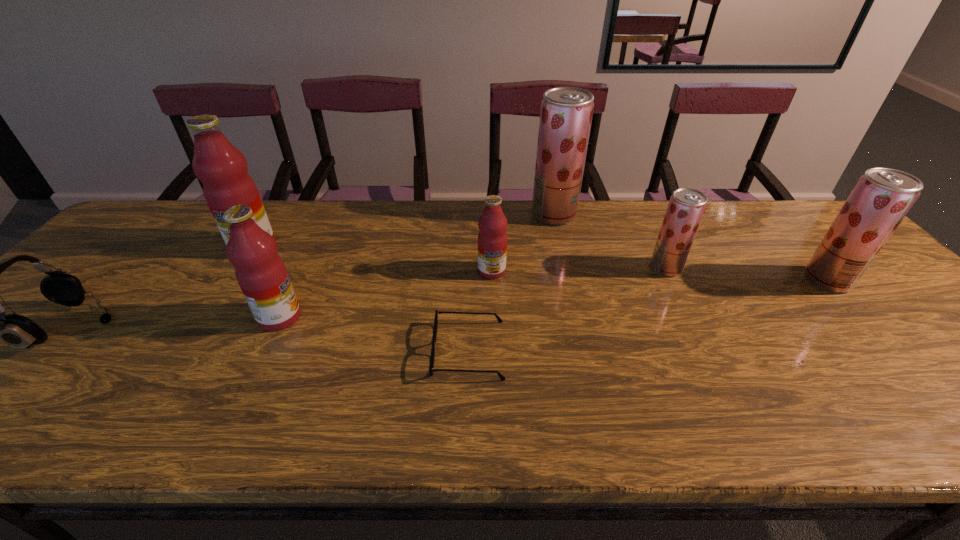
Locate an element on the screen. The height and width of the screenshot is (540, 960). vacant space located 0.060m on the label of the rightmost pink fruit juice is located at coordinates (492, 296).

Locate an element on the screen. This screenshot has width=960, height=540. free location located with the microphone on the side of the leftmost object is located at coordinates (218, 327).

Locate an element on the screen. This screenshot has width=960, height=540. vacant area situated on the front-facing side of the spectacles is located at coordinates (389, 350).

Locate an element on the screen. Image resolution: width=960 pixels, height=540 pixels. vacant position located on the front-facing side of the spectacles is located at coordinates (389, 350).

You are a GUI agent. You are given a task and a screenshot of the screen. Output one action in this format:
    pyautogui.click(x=<x>, y=<y>)
    Task: Click on the vacant space located 0.220m on the front-facing side of the spectacles
    This screenshot has height=540, width=960.
    Given the screenshot: What is the action you would take?
    pyautogui.click(x=335, y=350)

I want to click on object at the left edge, so click(19, 332).

You are a GUI agent. You are given a task and a screenshot of the screen. Output one action in this format:
    pyautogui.click(x=<x>, y=<y>)
    Task: Click on the object positioned at the right edge
    The image size is (960, 540).
    Given the screenshot: What is the action you would take?
    pyautogui.click(x=882, y=197)

Locate an element on the screen. vacant space at the far edge of the desktop is located at coordinates (282, 216).

You are a GUI agent. You are given a task and a screenshot of the screen. Output one action in this format:
    pyautogui.click(x=<x>, y=<y>)
    Task: Click on the free space at the near edge of the desktop
    
    Given the screenshot: What is the action you would take?
    pyautogui.click(x=39, y=403)

The height and width of the screenshot is (540, 960). Find the location of `vacant space at the left edge of the desktop`. vacant space at the left edge of the desktop is located at coordinates (111, 285).